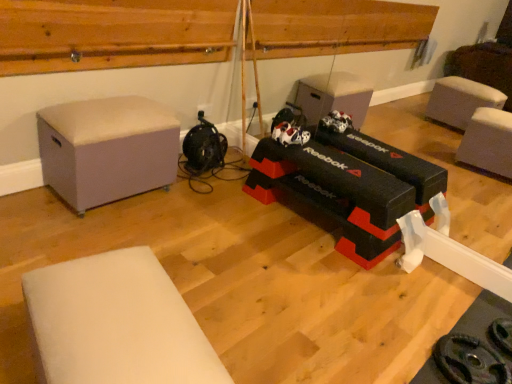
Describe the element at coordinates (106, 149) in the screenshot. I see `light gray fabric ottoman at left, acting as the 2th furniture starting from the front` at that location.

At what (x,y) coordinates should I click in order to perform the action: click on white foam mat at lower left, which is the 1th furniture in front-to-back order. Please return your answer as a coordinate pair (x, y). The height and width of the screenshot is (384, 512). Looking at the image, I should click on (116, 323).

Locate an element on the screen. wooden at upper center is located at coordinates (112, 34).

What's the angular difference between light gray fabric ottoman at left, acting as the 2th furniture starting from the front, and white foam mat at lower left, which is the 1th furniture in front-to-back order,'s facing directions?

light gray fabric ottoman at left, acting as the 2th furniture starting from the front, and white foam mat at lower left, which is the 1th furniture in front-to-back order, are facing 104 degrees away from each other.

Which of these two, light gray fabric ottoman at left, the 1th furniture positioned from the back, or white foam mat at lower left, which is the 1th furniture in front-to-back order, is thinner?

white foam mat at lower left, which is the 1th furniture in front-to-back order.

Where is `furniture located behind the white foam mat at lower left, positioned as the 2th furniture in back-to-front order`? This screenshot has width=512, height=384. furniture located behind the white foam mat at lower left, positioned as the 2th furniture in back-to-front order is located at coordinates (106, 149).

Measure the distance between light gray fabric ottoman at left, acting as the 2th furniture starting from the front, and white foam mat at lower left, which is the 1th furniture in front-to-back order.

They are 3.90 feet apart.

Which object is positioned more to the left, white foam mat at lower left, the first furniture positioned from the bottom, or wooden at upper center?

From the viewer's perspective, wooden at upper center appears more on the left side.

Does point (167, 322) come in front of point (27, 39)?

Yes, point (167, 322) is in front of point (27, 39).

Is white foam mat at lower left, the first furniture positioned from the bottom, aimed at wooden at upper center?

No.

From a real-world perspective, which is physically above, white foam mat at lower left, arranged as the second furniture when viewed from the top, or wooden at upper center?

wooden at upper center is physically above.

Considering the positions of objects wooden at upper center and white foam mat at lower left, arranged as the second furniture when viewed from the top, in the image provided, who is more to the right, wooden at upper center or white foam mat at lower left, arranged as the second furniture when viewed from the top,?

Positioned to the right is white foam mat at lower left, arranged as the second furniture when viewed from the top.

From the picture: Which object is closer to the camera, wooden at upper center or white foam mat at lower left, which is the 1th furniture in front-to-back order?

Positioned in front is white foam mat at lower left, which is the 1th furniture in front-to-back order.

In order to click on furniture that is the 2nd object directly below the wooden at upper center (from a real-world perspective) in this screenshot , I will do pyautogui.click(x=116, y=323).

Between point (163, 56) and point (123, 298), which one is positioned behind?

The point (163, 56) is farther from the camera.

Which of these two, wooden at upper center or light gray fabric ottoman at left, acting as the 2th furniture starting from the front, stands taller?

light gray fabric ottoman at left, acting as the 2th furniture starting from the front, is taller.

At what (x,y) coordinates should I click in order to perform the action: click on wood on the right of the light gray fabric ottoman at left, acting as the 2th furniture starting from the front. Please return your answer as a coordinate pair (x, y). The image size is (512, 384). Looking at the image, I should click on (112, 34).

Which is correct: wooden at upper center is inside light gray fabric ottoman at left, arranged as the first furniture when viewed from the top, or outside of it?

The correct answer is: outside.

From the image's perspective, which is above, wooden at upper center or light gray fabric ottoman at left, acting as the 2th furniture starting from the front?

wooden at upper center, from the image's perspective.

How many degrees apart are the facing directions of white foam mat at lower left, arranged as the second furniture when viewed from the top, and light gray fabric ottoman at left, arranged as the first furniture when viewed from the top?

The angular difference between white foam mat at lower left, arranged as the second furniture when viewed from the top, and light gray fabric ottoman at left, arranged as the first furniture when viewed from the top, is 104 degrees.

Considering the relative sizes of white foam mat at lower left, which is the 1th furniture in front-to-back order, and light gray fabric ottoman at left, the 1th furniture positioned from the back, in the image provided, is white foam mat at lower left, which is the 1th furniture in front-to-back order, wider than light gray fabric ottoman at left, the 1th furniture positioned from the back,?

No, white foam mat at lower left, which is the 1th furniture in front-to-back order, is not wider than light gray fabric ottoman at left, the 1th furniture positioned from the back.

Is white foam mat at lower left, positioned as the 2th furniture in back-to-front order, smaller than light gray fabric ottoman at left, acting as the 2th furniture starting from the front?

Indeed, white foam mat at lower left, positioned as the 2th furniture in back-to-front order, has a smaller size compared to light gray fabric ottoman at left, acting as the 2th furniture starting from the front.

From a real-world perspective, relative to light gray fabric ottoman at left, which is the 2th furniture from bottom to top, is white foam mat at lower left, positioned as the 2th furniture in back-to-front order, vertically above or below?

white foam mat at lower left, positioned as the 2th furniture in back-to-front order, is below light gray fabric ottoman at left, which is the 2th furniture from bottom to top.

From a real-world perspective, is light gray fabric ottoman at left, the 1th furniture positioned from the back, physically below wooden at upper center?

Yes, from a real-world perspective, light gray fabric ottoman at left, the 1th furniture positioned from the back, is under wooden at upper center.

Considering the relative sizes of light gray fabric ottoman at left, acting as the 2th furniture starting from the front, and wooden at upper center in the image provided, is light gray fabric ottoman at left, acting as the 2th furniture starting from the front, wider than wooden at upper center?

Correct, the width of light gray fabric ottoman at left, acting as the 2th furniture starting from the front, exceeds that of wooden at upper center.

Does light gray fabric ottoman at left, the 1th furniture positioned from the back, have a lesser height compared to wooden at upper center?

No, light gray fabric ottoman at left, the 1th furniture positioned from the back, is not shorter than wooden at upper center.

Where is `furniture on the right of light gray fabric ottoman at left, acting as the 2th furniture starting from the front`? This screenshot has width=512, height=384. furniture on the right of light gray fabric ottoman at left, acting as the 2th furniture starting from the front is located at coordinates (116, 323).

The height and width of the screenshot is (384, 512). I want to click on wood that is above the white foam mat at lower left, which is the 1th furniture in front-to-back order (from the image's perspective), so click(x=112, y=34).

Looking at the image, which one is located further to wooden at upper center, white foam mat at lower left, positioned as the 2th furniture in back-to-front order, or light gray fabric ottoman at left, arranged as the first furniture when viewed from the top?

white foam mat at lower left, positioned as the 2th furniture in back-to-front order.

Considering their positions, is wooden at upper center positioned closer to white foam mat at lower left, which is the 1th furniture in front-to-back order, than light gray fabric ottoman at left, which is the 2th furniture from bottom to top?

Among the two, light gray fabric ottoman at left, which is the 2th furniture from bottom to top, is located nearer to white foam mat at lower left, which is the 1th furniture in front-to-back order.

Which object lies nearer to the anchor point white foam mat at lower left, which is the 1th furniture in front-to-back order, light gray fabric ottoman at left, acting as the 2th furniture starting from the front, or wooden at upper center?

light gray fabric ottoman at left, acting as the 2th furniture starting from the front, lies closer to white foam mat at lower left, which is the 1th furniture in front-to-back order, than the other object.

Estimate the real-world distances between objects in this image. Which object is closer to light gray fabric ottoman at left, the 1th furniture positioned from the back, wooden at upper center or white foam mat at lower left, which is the 1th furniture in front-to-back order?

wooden at upper center.

Which object lies nearer to the anchor point wooden at upper center, light gray fabric ottoman at left, acting as the 2th furniture starting from the front, or white foam mat at lower left, the first furniture positioned from the bottom?

Among the two, light gray fabric ottoman at left, acting as the 2th furniture starting from the front, is located nearer to wooden at upper center.

Estimate the real-world distances between objects in this image. Which object is further from light gray fabric ottoman at left, the 1th furniture positioned from the back, white foam mat at lower left, the first furniture positioned from the bottom, or wooden at upper center?

white foam mat at lower left, the first furniture positioned from the bottom, lies further to light gray fabric ottoman at left, the 1th furniture positioned from the back, than the other object.

Find the location of a particular element. The width and height of the screenshot is (512, 384). furniture that lies between wooden at upper center and white foam mat at lower left, the first furniture positioned from the bottom, from top to bottom is located at coordinates (106, 149).